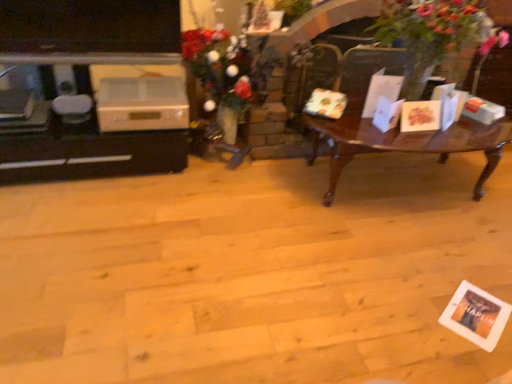
Find the location of a particular element. This screenshot has height=384, width=512. green leafy plant at right is located at coordinates (432, 35).

Find the location of a particular element. floral bouquet at center is located at coordinates (227, 72).

Where is `white glossy entertainment center at left`? Image resolution: width=512 pixels, height=384 pixels. white glossy entertainment center at left is located at coordinates (105, 139).

Is white glossy entertainment center at left oriented away from woodenwoodencoffee table at right?

No.

Where is `coffee table that appears below the white glossy entertainment center at left (from the image's perspective)`? The height and width of the screenshot is (384, 512). coffee table that appears below the white glossy entertainment center at left (from the image's perspective) is located at coordinates (405, 143).

Does white glossy entertainment center at left have a lesser height compared to woodenwoodencoffee table at right?

Correct, white glossy entertainment center at left is not as tall as woodenwoodencoffee table at right.

Can we say woodenwoodencoffee table at right lies outside green leafy plant at right?

Yes.

Would you consider woodenwoodencoffee table at right to be distant from green leafy plant at right?

No.

Which is behind, point (413, 141) or point (434, 64)?

Positioned behind is point (413, 141).

Which of these two, woodenwoodencoffee table at right or white glossy entertainment center at left, is bigger?

Bigger between the two is woodenwoodencoffee table at right.

Is woodenwoodencoffee table at right positioned with its back to white glossy entertainment center at left?

That's not correct — woodenwoodencoffee table at right is not looking away from white glossy entertainment center at left.

Are woodenwoodencoffee table at right and white glossy entertainment center at left far apart?

Absolutely, woodenwoodencoffee table at right is distant from white glossy entertainment center at left.

From the image's perspective, does floral bouquet at center appear lower than white glossy entertainment center at left?

Actually, floral bouquet at center appears above white glossy entertainment center at left in the image.

Which object is thinner, floral bouquet at center or white glossy entertainment center at left?

With smaller width is floral bouquet at center.

Considering the sizes of objects floral bouquet at center and white glossy entertainment center at left in the image provided, who is shorter, floral bouquet at center or white glossy entertainment center at left?

white glossy entertainment center at left.

Considering the relative sizes of floral bouquet at center and white glossy entertainment center at left in the image provided, is floral bouquet at center bigger than white glossy entertainment center at left?

Correct, floral bouquet at center is larger in size than white glossy entertainment center at left.

From a real-world perspective, which object rests below the other?

woodenwoodencoffee table at right.

From the image's perspective, is white plastic appliance at left on top of woodenwoodencoffee table at right?

Yes, from the image's perspective, white plastic appliance at left is on top of woodenwoodencoffee table at right.

Is white plastic appliance at left next to woodenwoodencoffee table at right and touching it?

No, white plastic appliance at left is not beside woodenwoodencoffee table at right.

Is woodenwoodencoffee table at right a part of white plastic appliance at left?

No.

From a real-world perspective, is white plastic appliance at left above or below white glossy entertainment center at left?

white plastic appliance at left is above white glossy entertainment center at left.

Between point (176, 107) and point (180, 127), which one is positioned behind?

The point (180, 127) is farther from the camera.

How different are the orientations of white plastic appliance at left and white glossy entertainment center at left in degrees?

They differ by 0.000135 degrees in their facing directions.

In terms of size, does white plastic appliance at left appear bigger or smaller than white glossy entertainment center at left?

white plastic appliance at left is smaller than white glossy entertainment center at left.

Which object is more forward, floral bouquet at center or woodenwoodencoffee table at right?

woodenwoodencoffee table at right.

From the image's perspective, does floral bouquet at center appear lower than woodenwoodencoffee table at right?

No, from the image's perspective, floral bouquet at center is not beneath woodenwoodencoffee table at right.

Locate an element on the screen. The image size is (512, 384). entertainment center below the woodenwoodencoffee table at right (from a real-world perspective) is located at coordinates (105, 139).

Identify the location of houseplant that appears above the woodenwoodencoffee table at right (from a real-world perspective). This screenshot has width=512, height=384. (432, 35).

Looking at the image, which one is located closer to white plastic appliance at left, woodenwoodencoffee table at right or white glossy entertainment center at left?

The object closer to white plastic appliance at left is white glossy entertainment center at left.

When comparing their distances from floral bouquet at center, does white glossy entertainment center at left or green leafy plant at right seem further?

green leafy plant at right is positioned further to the anchor floral bouquet at center.

From the picture: Which object lies nearer to the anchor point floral bouquet at center, white glossy entertainment center at left or white plastic appliance at left?

white plastic appliance at left.

Looking at the image, which one is located closer to floral bouquet at center, green leafy plant at right or white glossy entertainment center at left?

Based on the image, white glossy entertainment center at left appears to be nearer to floral bouquet at center.

Estimate the real-world distances between objects in this image. Which object is further from woodenwoodencoffee table at right, white plastic appliance at left or floral bouquet at center?

white plastic appliance at left lies further to woodenwoodencoffee table at right than the other object.

Estimate the real-world distances between objects in this image. Which object is further from white plastic appliance at left, woodenwoodencoffee table at right or green leafy plant at right?

green leafy plant at right.

Based on their spatial positions, is green leafy plant at right or woodenwoodencoffee table at right closer to white plastic appliance at left?

The object closer to white plastic appliance at left is woodenwoodencoffee table at right.

Estimate the real-world distances between objects in this image. Which object is further from floral bouquet at center, green leafy plant at right or woodenwoodencoffee table at right?

Among the two, green leafy plant at right is located further to floral bouquet at center.

In order to click on floral arrangement between white glossy entertainment center at left and green leafy plant at right in this screenshot , I will do `click(227, 72)`.

The image size is (512, 384). Find the location of `coffee table situated between white plastic appliance at left and green leafy plant at right from left to right`. coffee table situated between white plastic appliance at left and green leafy plant at right from left to right is located at coordinates pyautogui.click(x=405, y=143).

Locate an element on the screen. The image size is (512, 384). appliance situated between white glossy entertainment center at left and green leafy plant at right from left to right is located at coordinates (142, 104).

Where is `floral arrangement between white plastic appliance at left and green leafy plant at right`? Image resolution: width=512 pixels, height=384 pixels. floral arrangement between white plastic appliance at left and green leafy plant at right is located at coordinates (227, 72).